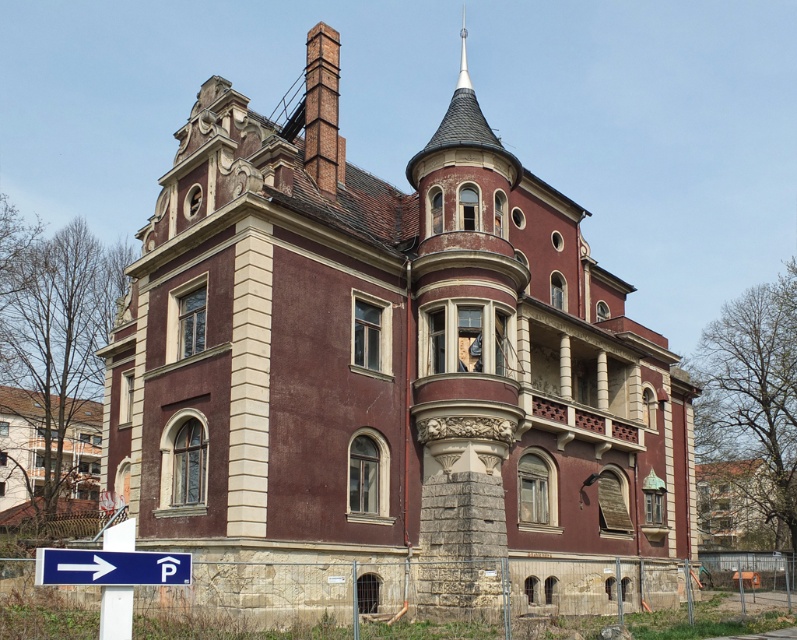
Describe the element at coordinates (46, 452) in the screenshot. This screenshot has width=797, height=640. I see `rustic stone mansion at upper left` at that location.

Locate an element on the screen. rustic stone mansion at upper left is located at coordinates (46, 452).

Image resolution: width=797 pixels, height=640 pixels. I want to click on rustic stone mansion at upper left, so click(x=46, y=452).

Is maroon stone mansion at center smaller than rustic stone mansion at upper left?

Actually, maroon stone mansion at center might be larger than rustic stone mansion at upper left.

Is point (580, 483) positioned after point (14, 401)?

That is False.

Image resolution: width=797 pixels, height=640 pixels. In order to click on maroon stone mansion at center in this screenshot , I will do `click(391, 365)`.

Can you confirm if maroon stone mansion at center is bigger than blue plastic arrow at lower left?

Correct, maroon stone mansion at center is larger in size than blue plastic arrow at lower left.

Identify the location of maroon stone mansion at center. The width and height of the screenshot is (797, 640). (391, 365).